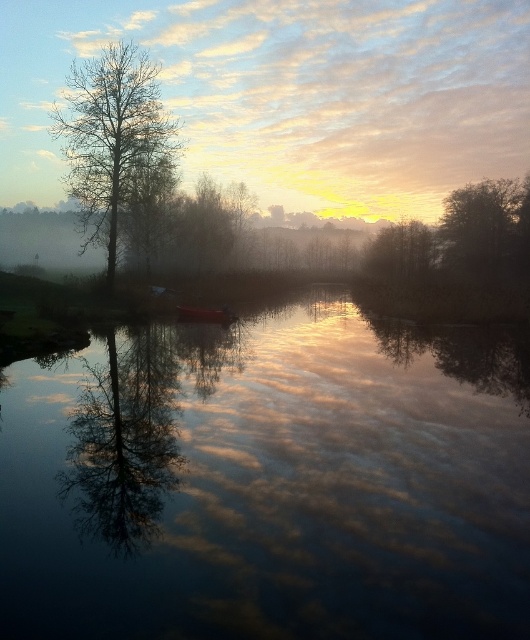
You are an artist trying to paint the scene. You want to ensure the smooth water at center and the bare branches tree at left are proportionally accurate. Which object should you paint to be wider?

The bare branches tree at left should be painted wider since it has a greater width than the smooth water at center according to the description.

You are standing at the edge of the water and see two points in the scene. Which point is closer to you, point (x=234, y=595) or point (x=183, y=172)?

Point (x=234, y=595) is closer to the viewer than point (x=183, y=172).

You are standing at the center of the image and want to walk to the smooth tree at left. Which direction should you go?

You should walk to the left to reach the smooth tree at left since it is located at point 0.150 on the horizontal axis, which is to the left of the center position at 0.5.